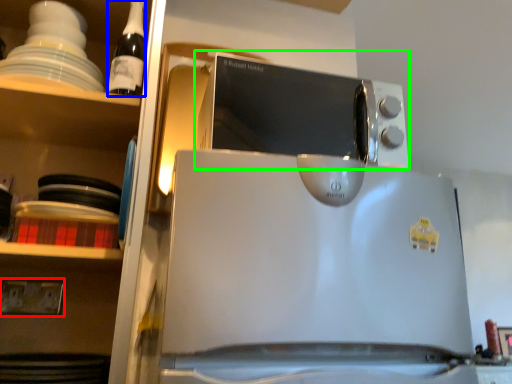
Question: Which is farther away from electric outlet (highlighted by a red box)? bottle (highlighted by a blue box) or microwave oven (highlighted by a green box)?

Choices:
 (A) bottle
 (B) microwave oven

Answer: (B)